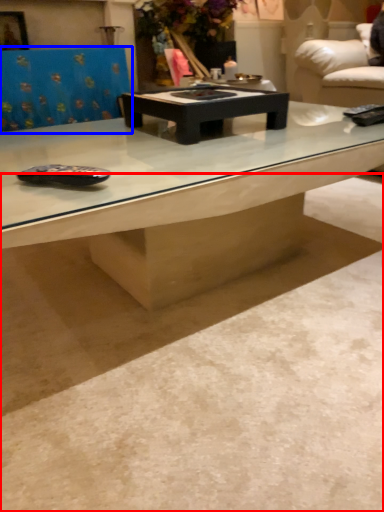
Question: Which object is further to the camera taking this photo, concrete (highlighted by a red box) or swivel chair (highlighted by a blue box)?

Choices:
 (A) concrete
 (B) swivel chair

Answer: (B)